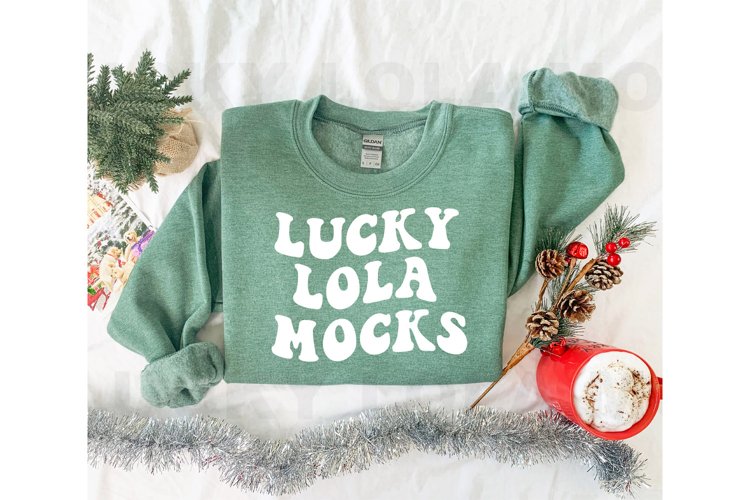
Where is `flower pot`? flower pot is located at coordinates (175, 147).